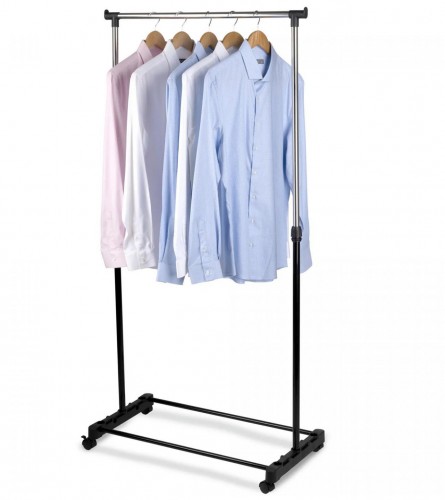
Locate an element on the screen. The height and width of the screenshot is (500, 445). shirt hangers is located at coordinates (260, 36), (232, 36), (205, 38), (184, 40), (154, 43).